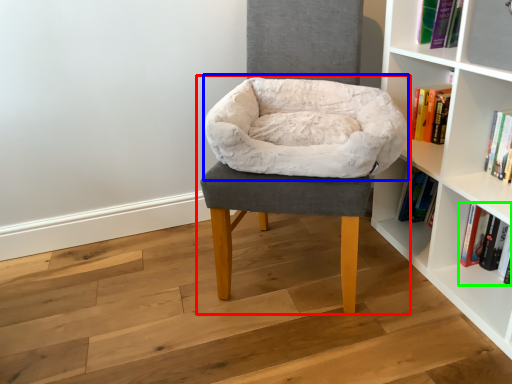
Question: Which is farther away from chair (highlighted by a red box)? bean bag chair (highlighted by a blue box) or book (highlighted by a green box)?

Choices:
 (A) bean bag chair
 (B) book

Answer: (B)